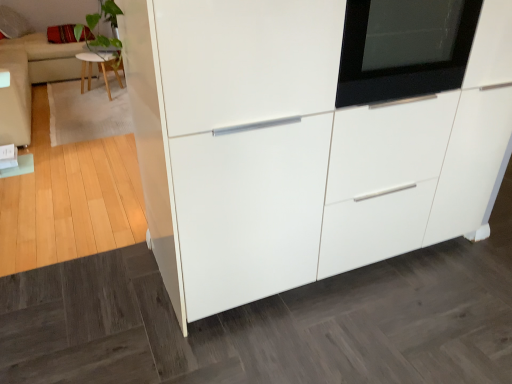
The width and height of the screenshot is (512, 384). What do you see at coordinates (404, 48) in the screenshot? I see `black glass oven at upper right` at bounding box center [404, 48].

Locate an element on the screen. This screenshot has width=512, height=384. black glass oven at upper right is located at coordinates (404, 48).

Identify the location of oven behind the white glossy cabinet at center. (404, 48).

Do you think black glass oven at upper right is within white glossy cabinet at center, or outside of it?

black glass oven at upper right exists entirely within white glossy cabinet at center.

Is black glass oven at upper right beside white glossy cabinet at center?

black glass oven at upper right is not next to white glossy cabinet at center, and they're not touching.

From their relative heights in the image, would you say black glass oven at upper right is taller or shorter than white glossy cabinet at center?

black glass oven at upper right is shorter than white glossy cabinet at center.

How distant is velvet red pillow at upper left from beige fabric couch at left, acting as the 2th couch starting from the top?

They are 1.11 meters apart.

There is a velvet red pillow at upper left. Where is `the 2nd couch below it (from a real-world perspective)`? The width and height of the screenshot is (512, 384). the 2nd couch below it (from a real-world perspective) is located at coordinates (15, 99).

Consider the image. Is velvet red pillow at upper left to the right of beige fabric couch at left, arranged as the second couch when viewed from the left, from the viewer's perspective?

No.

Looking at this image, considering the relative sizes of velvet red pillow at upper left and beige fabric couch at left, arranged as the second couch when viewed from the left, in the image provided, is velvet red pillow at upper left shorter than beige fabric couch at left, arranged as the second couch when viewed from the left,?

Yes, velvet red pillow at upper left is shorter than beige fabric couch at left, arranged as the second couch when viewed from the left.

Is light wood stool at upper left to the left or to the right of black glass oven at upper right in the image?

Based on their positions, light wood stool at upper left is located to the left of black glass oven at upper right.

Is light wood stool at upper left touching black glass oven at upper right?

No, light wood stool at upper left is not beside black glass oven at upper right.

Considering the sizes of light wood stool at upper left and black glass oven at upper right in the image, is light wood stool at upper left taller or shorter than black glass oven at upper right?

light wood stool at upper left is taller than black glass oven at upper right.

Does light wood stool at upper left have a greater width compared to black glass oven at upper right?

Indeed, light wood stool at upper left has a greater width compared to black glass oven at upper right.

Based on their sizes in the image, would you say white glossy cabinet at center is bigger or smaller than beige fabric couch at upper left, the second couch in the right-to-left sequence?

Considering their sizes, white glossy cabinet at center takes up more space than beige fabric couch at upper left, the second couch in the right-to-left sequence.

How distant is white glossy cabinet at center from beige fabric couch at upper left, which appears as the second couch when viewed from the front?

11.68 feet.

Does point (137, 18) come farther from viewer compared to point (28, 69)?

That is False.

Consider the image. Which is correct: white glossy cabinet at center is inside beige fabric couch at upper left, which appears as the second couch when viewed from the front, or outside of it?

white glossy cabinet at center cannot be found inside beige fabric couch at upper left, which appears as the second couch when viewed from the front.

Between beige fabric couch at upper left, the 1th couch from the back, and light wood stool at upper left, which one has larger size?

beige fabric couch at upper left, the 1th couch from the back, is bigger.

Are beige fabric couch at upper left, the 2th couch when ordered from bottom to top, and light wood stool at upper left beside each other?

No.

Considering the relative positions of beige fabric couch at upper left, which appears as the second couch when viewed from the front, and light wood stool at upper left in the image provided, is beige fabric couch at upper left, which appears as the second couch when viewed from the front, in front of light wood stool at upper left?

No, beige fabric couch at upper left, which appears as the second couch when viewed from the front, is further to the viewer.

Looking at their sizes, would you say beige fabric couch at upper left, which is counted as the 1th couch, starting from the left, is wider or thinner than light wood stool at upper left?

beige fabric couch at upper left, which is counted as the 1th couch, starting from the left, is wider than light wood stool at upper left.

Is beige fabric couch at upper left, the second couch in the right-to-left sequence, far away from beige fabric couch at left, the 2th couch positioned from the back?

That's not correct — beige fabric couch at upper left, the second couch in the right-to-left sequence, is a little close to beige fabric couch at left, the 2th couch positioned from the back.

Does beige fabric couch at upper left, the 1th couch from the back, have a larger size compared to beige fabric couch at left, which is counted as the 1th couch, starting from the bottom?

Answer: Yes.

In terms of height, does beige fabric couch at upper left, the 1th couch from the back, look taller or shorter compared to beige fabric couch at left, which is counted as the 1th couch, starting from the bottom?

Clearly, beige fabric couch at upper left, the 1th couch from the back, is taller compared to beige fabric couch at left, which is counted as the 1th couch, starting from the bottom.

Can you tell me how much beige fabric couch at upper left, which is counted as the 1th couch, starting from the left, and beige fabric couch at left, the 2th couch positioned from the back, differ in facing direction?

beige fabric couch at upper left, which is counted as the 1th couch, starting from the left, and beige fabric couch at left, the 2th couch positioned from the back, are facing 0.552 degrees away from each other.

Is black glass oven at upper right bigger than beige fabric couch at left, acting as the 1th couch starting from the front?

No.

Is black glass oven at upper right positioned beyond the bounds of beige fabric couch at left, acting as the first couch starting from the right?

Yes, black glass oven at upper right is outside of beige fabric couch at left, acting as the first couch starting from the right.

Is black glass oven at upper right facing away from beige fabric couch at left, which is counted as the 1th couch, starting from the bottom?

No, black glass oven at upper right is not facing the opposite direction of beige fabric couch at left, which is counted as the 1th couch, starting from the bottom.

Which object is closer to the camera, black glass oven at upper right or beige fabric couch at left, arranged as the second couch when viewed from the left?

black glass oven at upper right is in front.

The height and width of the screenshot is (384, 512). What are the coordinates of `cabinetry on the left of black glass oven at upper right` in the screenshot? It's located at (x=310, y=136).

From a real-world perspective, starting from the velvet red pillow at upper left, which couch is the 2nd one below it? Please provide its 2D coordinates.

[(15, 99)]

Based on their spatial positions, is white glossy cabinet at center or beige fabric couch at upper left, the 1th couch from the back, closer to beige fabric couch at left, arranged as the second couch when viewed from the left?

beige fabric couch at upper left, the 1th couch from the back, is closer to beige fabric couch at left, arranged as the second couch when viewed from the left.

Based on their spatial positions, is beige fabric couch at upper left, the 2th couch when ordered from bottom to top, or black glass oven at upper right closer to beige fabric couch at left, arranged as the second couch when viewed from the left?

beige fabric couch at upper left, the 2th couch when ordered from bottom to top, lies closer to beige fabric couch at left, arranged as the second couch when viewed from the left, than the other object.

From the picture: Based on their spatial positions, is beige fabric couch at upper left, which appears as the second couch when viewed from the front, or light wood stool at upper left further from velvet red pillow at upper left?

light wood stool at upper left.

Based on their spatial positions, is light wood stool at upper left or white glossy cabinet at center closer to black glass oven at upper right?

The object closer to black glass oven at upper right is white glossy cabinet at center.

Looking at the image, which one is located closer to light wood stool at upper left, beige fabric couch at upper left, which is counted as the 1th couch, starting from the left, or black glass oven at upper right?

The object closer to light wood stool at upper left is beige fabric couch at upper left, which is counted as the 1th couch, starting from the left.

Looking at the image, which one is located further to velvet red pillow at upper left, beige fabric couch at left, acting as the first couch starting from the right, or light wood stool at upper left?

beige fabric couch at left, acting as the first couch starting from the right.

Considering their positions, is black glass oven at upper right positioned further to light wood stool at upper left than beige fabric couch at upper left, the 1th couch from the back?

The object further to light wood stool at upper left is black glass oven at upper right.

From the picture: Estimate the real-world distances between objects in this image. Which object is further from beige fabric couch at upper left, the second couch in the right-to-left sequence, white glossy cabinet at center or velvet red pillow at upper left?

white glossy cabinet at center is positioned further to the anchor beige fabric couch at upper left, the second couch in the right-to-left sequence.

Locate an element on the screen. couch located between beige fabric couch at left, acting as the first couch starting from the right, and velvet red pillow at upper left in the depth direction is located at coordinates (47, 57).

Identify the location of cabinetry situated between beige fabric couch at left, which is counted as the 1th couch, starting from the bottom, and black glass oven at upper right from left to right. Image resolution: width=512 pixels, height=384 pixels. (x=310, y=136).

Locate an element on the screen. The height and width of the screenshot is (384, 512). oven between white glossy cabinet at center and velvet red pillow at upper left along the z-axis is located at coordinates (404, 48).

This screenshot has height=384, width=512. In order to click on couch located between beige fabric couch at upper left, arranged as the first couch when viewed from the top, and black glass oven at upper right in the left-right direction in this screenshot , I will do tap(15, 99).